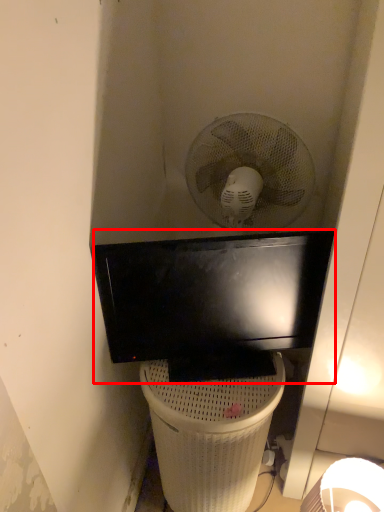
Question: Observing the image, what is the correct spatial positioning of television (annotated by the red box) in reference to trash bin/can?

Choices:
 (A) left
 (B) right

Answer: (B)